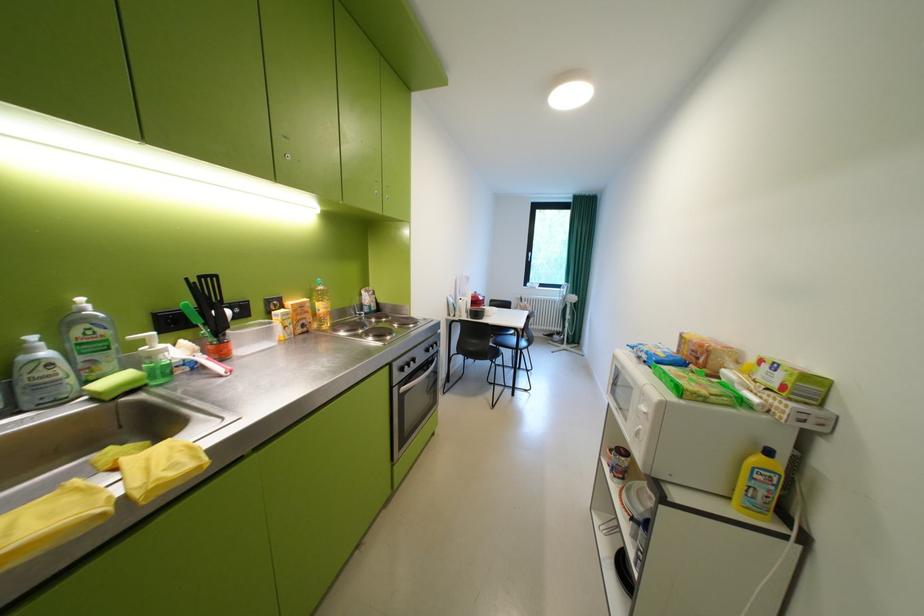
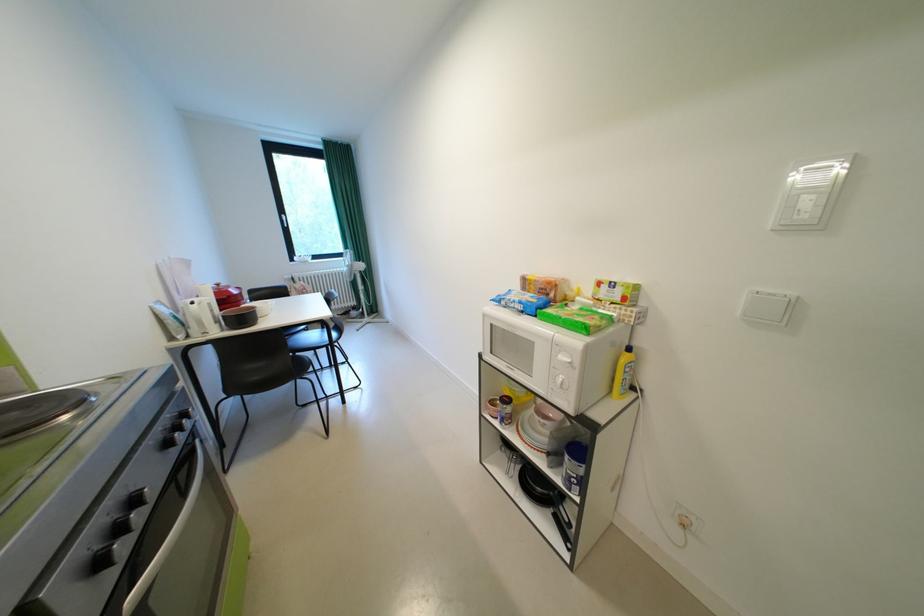
The point at (x=424, y=361) is marked in the first image. Where is the corresponding point in the second image?

(146, 501)